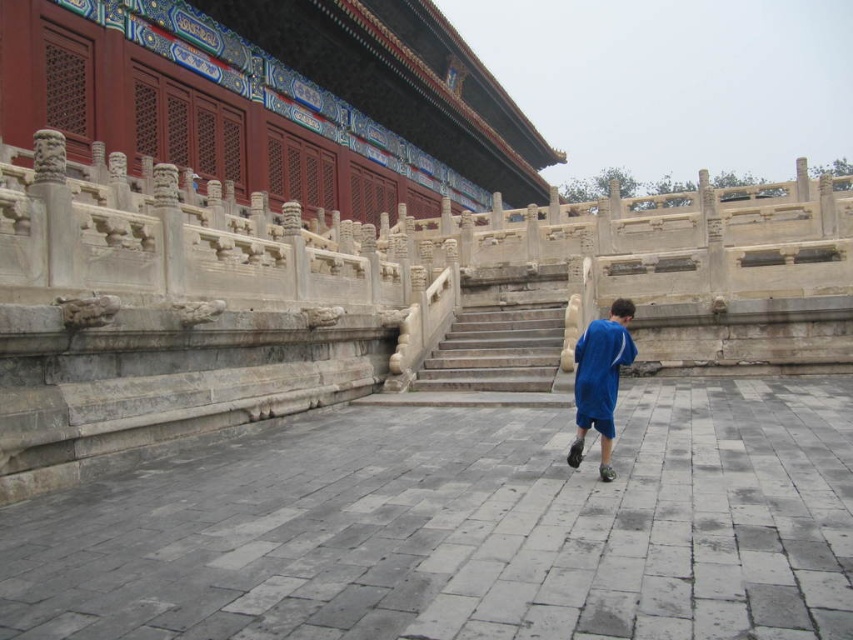
Question: Observing the image, what is the correct spatial positioning of stone stairs at center in reference to blue fabric shorts at center?

Choices:
 (A) below
 (B) above

Answer: (B)

Question: Which point is farther to the camera?

Choices:
 (A) stone stairs at center
 (B) blue fabric shorts at center

Answer: (A)

Question: Is stone stairs at center bigger than blue fabric shorts at center?

Choices:
 (A) no
 (B) yes

Answer: (A)

Question: Can you confirm if stone stairs at center is positioned below blue fabric shorts at center?

Choices:
 (A) yes
 (B) no

Answer: (B)